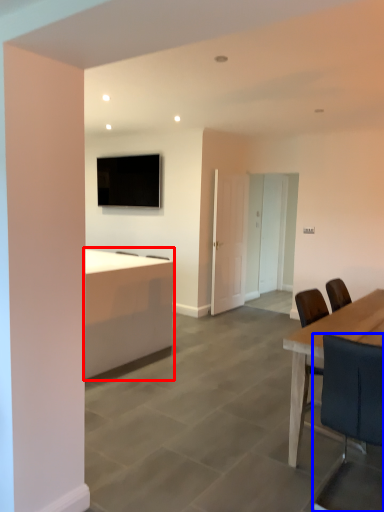
Question: Which object is closer to the camera taking this photo, desk (highlighted by a red box) or chair (highlighted by a blue box)?

Choices:
 (A) desk
 (B) chair

Answer: (B)